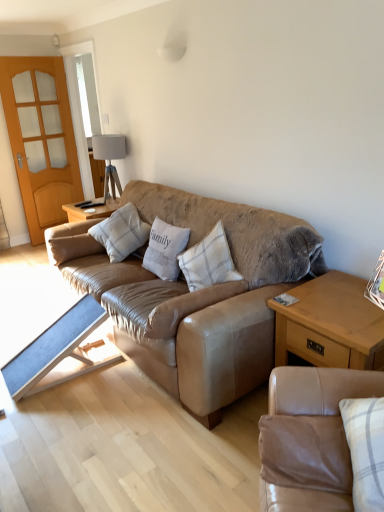
Looking at this image, measure the distance between white fabric lampshade at upper center and camera.

white fabric lampshade at upper center and camera are 3.88 meters apart from each other.

This screenshot has height=512, width=384. I want to click on leather couch at center, the 1th studio couch viewed from the back, so click(x=202, y=297).

What do you see at coordinates (71, 247) in the screenshot? Image resolution: width=384 pixels, height=512 pixels. I see `light gray textured pillow at center, which ranks as the first pillow in left-to-right order` at bounding box center [71, 247].

What are the coordinates of `blue fabric table at lower left, which appears as the 2th table when viewed from the right` in the screenshot? It's located at (61, 352).

Is light gray textured pillow at center, which ranks as the first pillow in left-to-right order, surrounded by light brown wooden screen door at left?

Definitely not — light gray textured pillow at center, which ranks as the first pillow in left-to-right order, is not inside light brown wooden screen door at left.

Are light brown wooden screen door at left and light gray textured pillow at center, which ranks as the first pillow in left-to-right order, far apart?

Yes.

Which of these two, light brown wooden screen door at left or light gray textured pillow at center, which appears as the 4th pillow when viewed from the right, is thinner?

light brown wooden screen door at left.

In terms of height, does light brown wooden screen door at left look taller or shorter compared to light gray textured pillow at center, which appears as the 4th pillow when viewed from the right?

Clearly, light brown wooden screen door at left is taller compared to light gray textured pillow at center, which appears as the 4th pillow when viewed from the right.

Is light brown wooden screen door at left turned away from blue fabric table at lower left, which appears as the 2th table when viewed from the right?

light brown wooden screen door at left does not have its back to blue fabric table at lower left, which appears as the 2th table when viewed from the right.

Which is more to the right, light brown wooden screen door at left or blue fabric table at lower left, the first table when ordered from left to right?

blue fabric table at lower left, the first table when ordered from left to right, is more to the right.

From a real-world perspective, is light brown wooden screen door at left positioned over blue fabric table at lower left, the first table when ordered from left to right, based on gravity?

Indeed, from a real-world perspective, light brown wooden screen door at left stands above blue fabric table at lower left, the first table when ordered from left to right.

Between light brown wooden screen door at left and blue fabric table at lower left, which appears as the 2th table when viewed from the right, which one has smaller width?

light brown wooden screen door at left is thinner.

From the image's perspective, is light wood/texture side table at lower right, which is the 2th table from left to right, above or below white fabric lampshade at upper center?

light wood/texture side table at lower right, which is the 2th table from left to right, is below white fabric lampshade at upper center.

In the scene shown: Would you say light wood/texture side table at lower right, which is the first table from right to left, is outside white fabric lampshade at upper center?

That's correct, light wood/texture side table at lower right, which is the first table from right to left, is outside of white fabric lampshade at upper center.

Is leather couch at center, the first studio couch positioned from the top, shorter than white cotton pillow at center, which ranks as the 2th pillow in right-to-left order?

No.

From a real-world perspective, which is physically below, leather couch at center, the 1th studio couch viewed from the back, or white cotton pillow at center, which ranks as the 2th pillow in right-to-left order?

leather couch at center, the 1th studio couch viewed from the back, from a real-world perspective.

Consider the image. Is leather couch at center, the 2th studio couch viewed from the front, positioned with its back to white cotton pillow at center, which is the 3th pillow from left to right?

Yes, leather couch at center, the 2th studio couch viewed from the front, is facing away from white cotton pillow at center, which is the 3th pillow from left to right.

Is leather couch at center, the 1th studio couch viewed from the back, positioned far away from white cotton pillow at center, which is the 3th pillow from left to right?

No, leather couch at center, the 1th studio couch viewed from the back, is not far from white cotton pillow at center, which is the 3th pillow from left to right.

Can you confirm if tan leather couch at lower right, the second studio couch when ordered from top to bottom, is positioned to the left of blue fabric table at lower left, the first table when ordered from left to right?

Incorrect, tan leather couch at lower right, the second studio couch when ordered from top to bottom, is not on the left side of blue fabric table at lower left, the first table when ordered from left to right.

Looking at this image, is tan leather couch at lower right, positioned as the first studio couch in bottom-to-top order, oriented away from blue fabric table at lower left, the first table when ordered from left to right?

No, tan leather couch at lower right, positioned as the first studio couch in bottom-to-top order, is not facing away from blue fabric table at lower left, the first table when ordered from left to right.

From the image's perspective, which is above, tan leather couch at lower right, the second studio couch when ordered from top to bottom, or blue fabric table at lower left, the first table when ordered from left to right?

blue fabric table at lower left, the first table when ordered from left to right, is shown above in the image.

Is tan leather couch at lower right, the first studio couch positioned from the front, beside blue fabric table at lower left, the first table when ordered from left to right?

No, tan leather couch at lower right, the first studio couch positioned from the front, is not touching blue fabric table at lower left, the first table when ordered from left to right.

Considering the points (352, 507) and (201, 282), which point is in front, point (352, 507) or point (201, 282)?

Point (352, 507)

From a real-world perspective, is tan leather couch at lower right, positioned as the first studio couch in bottom-to-top order, below plaid fabric pillow at center, which ranks as the first pillow in right-to-left order?

Yes, from a real-world perspective, tan leather couch at lower right, positioned as the first studio couch in bottom-to-top order, is beneath plaid fabric pillow at center, which ranks as the first pillow in right-to-left order.

Can you confirm if tan leather couch at lower right, positioned as the first studio couch in bottom-to-top order, is wider than plaid fabric pillow at center, which ranks as the first pillow in right-to-left order?

In fact, tan leather couch at lower right, positioned as the first studio couch in bottom-to-top order, might be narrower than plaid fabric pillow at center, which ranks as the first pillow in right-to-left order.

Which object is positioned more to the left, tan leather couch at lower right, the first studio couch positioned from the front, or plaid fabric pillow at center, which ranks as the first pillow in right-to-left order?

plaid fabric pillow at center, which ranks as the first pillow in right-to-left order, is more to the left.

Who is shorter, leather couch at center, the 2th studio couch viewed from the front, or tan leather couch at lower right, which appears as the 2th studio couch when viewed from the back?

tan leather couch at lower right, which appears as the 2th studio couch when viewed from the back.

At what (x,y) coordinates should I click in order to perform the action: click on studio couch above the tan leather couch at lower right, positioned as the first studio couch in bottom-to-top order (from the image's perspective). Please return your answer as a coordinate pair (x, y). The height and width of the screenshot is (512, 384). Looking at the image, I should click on (202, 297).

From a real-world perspective, who is located lower, leather couch at center, the 1th studio couch viewed from the back, or tan leather couch at lower right, the first studio couch positioned from the front?

leather couch at center, the 1th studio couch viewed from the back.

Consider the image. From the image's perspective, relative to tan leather couch at lower right, which appears as the 2th studio couch when viewed from the back, is leather couch at center, the 2th studio couch positioned from the bottom, above or below?

Based on their image positions, leather couch at center, the 2th studio couch positioned from the bottom, is located above tan leather couch at lower right, which appears as the 2th studio couch when viewed from the back.

Find the location of a particular element. This screenshot has width=384, height=512. screen door behind the light gray textured pillow at center, which appears as the 4th pillow when viewed from the right is located at coordinates (41, 139).

Which table is the 1st one when counting from the front of the light brown wooden screen door at left? Please provide its 2D coordinates.

[(61, 352)]

From the picture: Which object lies nearer to the anchor point light wood/texture side table at lower right, which is the 2th table from left to right, tan leather couch at lower right, the first studio couch positioned from the front, or plaid fabric pillow at center, placed as the 4th pillow when sorted from left to right?

tan leather couch at lower right, the first studio couch positioned from the front.

Looking at the image, which one is located further to light wood/texture side table at lower right, which is the first table from right to left, blue fabric table at lower left, the first table when ordered from left to right, or light brown wooden screen door at left?

light brown wooden screen door at left lies further to light wood/texture side table at lower right, which is the first table from right to left, than the other object.

Which object lies further to the anchor point leather couch at center, the 2th studio couch positioned from the bottom, tan leather couch at lower right, which appears as the 2th studio couch when viewed from the back, or white cotton pillow at center, which is the 3th pillow from left to right?

Among the two, tan leather couch at lower right, which appears as the 2th studio couch when viewed from the back, is located further to leather couch at center, the 2th studio couch positioned from the bottom.

Based on their spatial positions, is white cotton pillow at center, which ranks as the 2th pillow in right-to-left order, or blue fabric table at lower left, the first table when ordered from left to right, closer to white fabric lampshade at upper center?

white cotton pillow at center, which ranks as the 2th pillow in right-to-left order, is closer to white fabric lampshade at upper center.

When comparing their distances from plaid fabric pillow at center, the 2th pillow positioned from the left, does tan leather couch at lower right, the second studio couch when ordered from top to bottom, or white cotton pillow at center, which is the 3th pillow from left to right, seem further?

Based on the image, tan leather couch at lower right, the second studio couch when ordered from top to bottom, appears to be further to plaid fabric pillow at center, the 2th pillow positioned from the left.

Based on their spatial positions, is leather couch at center, the 2th studio couch positioned from the bottom, or white fabric lampshade at upper center closer to white cotton pillow at center, which ranks as the 2th pillow in right-to-left order?

Among the two, leather couch at center, the 2th studio couch positioned from the bottom, is located nearer to white cotton pillow at center, which ranks as the 2th pillow in right-to-left order.

Considering their positions, is white cotton pillow at center, which ranks as the 2th pillow in right-to-left order, positioned further to plaid fabric pillow at center, which ranks as the third pillow in right-to-left order, than light brown wooden screen door at left?

light brown wooden screen door at left is positioned further to the anchor plaid fabric pillow at center, which ranks as the third pillow in right-to-left order.

Looking at the image, which one is located closer to leather couch at center, the 2th studio couch positioned from the bottom, blue fabric table at lower left, the first table when ordered from left to right, or plaid fabric pillow at center, placed as the 4th pillow when sorted from left to right?

The object closer to leather couch at center, the 2th studio couch positioned from the bottom, is plaid fabric pillow at center, placed as the 4th pillow when sorted from left to right.

The image size is (384, 512). Find the location of `table between light gray textured pillow at center, which appears as the 4th pillow when viewed from the right, and light wood/texture side table at lower right, which is the first table from right to left, from left to right`. table between light gray textured pillow at center, which appears as the 4th pillow when viewed from the right, and light wood/texture side table at lower right, which is the first table from right to left, from left to right is located at coordinates coord(61,352).

The height and width of the screenshot is (512, 384). I want to click on pillow between tan leather couch at lower right, the second studio couch when ordered from top to bottom, and white cotton pillow at center, which is the 3th pillow from left to right, along the z-axis, so click(x=208, y=261).

Where is `lamp located between tan leather couch at lower right, the first studio couch positioned from the front, and light brown wooden screen door at left in the depth direction`? lamp located between tan leather couch at lower right, the first studio couch positioned from the front, and light brown wooden screen door at left in the depth direction is located at coordinates (109, 159).

Locate an element on the screen. This screenshot has width=384, height=512. table between tan leather couch at lower right, the second studio couch when ordered from top to bottom, and plaid fabric pillow at center, which ranks as the first pillow in right-to-left order, along the z-axis is located at coordinates (330, 324).